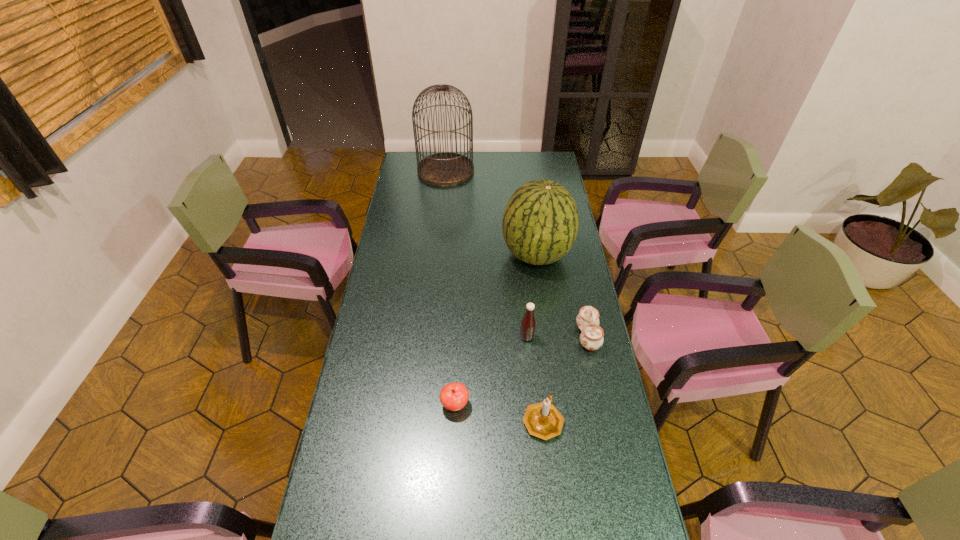
Image resolution: width=960 pixels, height=540 pixels. I want to click on vacant point located on the back of the Tabasco sauce, so click(520, 268).

The image size is (960, 540). Find the location of `free space located 0.100m on the left of the candle holder`. free space located 0.100m on the left of the candle holder is located at coordinates (489, 421).

At what (x,y) coordinates should I click in order to perform the action: click on blank space located 0.220m by the handle of the chinaware. Please return your answer as a coordinate pair (x, y). This screenshot has width=960, height=540. Looking at the image, I should click on (514, 336).

Find the location of a particular element. Image resolution: width=960 pixels, height=540 pixels. free space located 0.140m by the handle of the chinaware is located at coordinates (537, 336).

Where is `free region located 0.050m by the handle of the chinaware`? The image size is (960, 540). free region located 0.050m by the handle of the chinaware is located at coordinates (563, 336).

This screenshot has height=540, width=960. Find the location of `blank space located 0.060m on the right of the shortest object`. blank space located 0.060m on the right of the shortest object is located at coordinates (489, 404).

What are the coordinates of `object located at the far edge` in the screenshot? It's located at (442, 169).

I want to click on object located at the left edge, so (x=442, y=169).

Locate an element on the screen. watermelon that is positioned at the right edge is located at coordinates (540, 223).

Locate an element on the screen. Image resolution: width=960 pixels, height=540 pixels. chinaware that is positioned at the right edge is located at coordinates (591, 337).